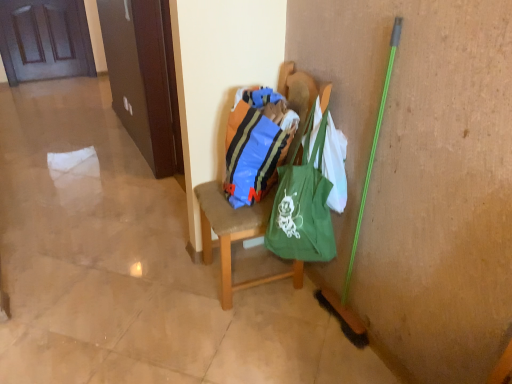
Question: From the image's perspective, relative to green canvas tote at center, is blue striped fabric bag at center above or below?

Choices:
 (A) below
 (B) above

Answer: (B)

Question: Choose the correct answer: Is blue striped fabric bag at center inside green canvas tote at center or outside it?

Choices:
 (A) outside
 (B) inside

Answer: (A)

Question: Considering the real-world distances, which object is farthest from the green canvas tote at center?

Choices:
 (A) blue striped fabric bag at center
 (B) wooden chair at center
 (C) wooden door at upper left

Answer: (C)

Question: Which object is positioned farthest from the blue striped fabric bag at center?

Choices:
 (A) wooden door at upper left
 (B) wooden chair at center
 (C) green canvas tote at center

Answer: (A)